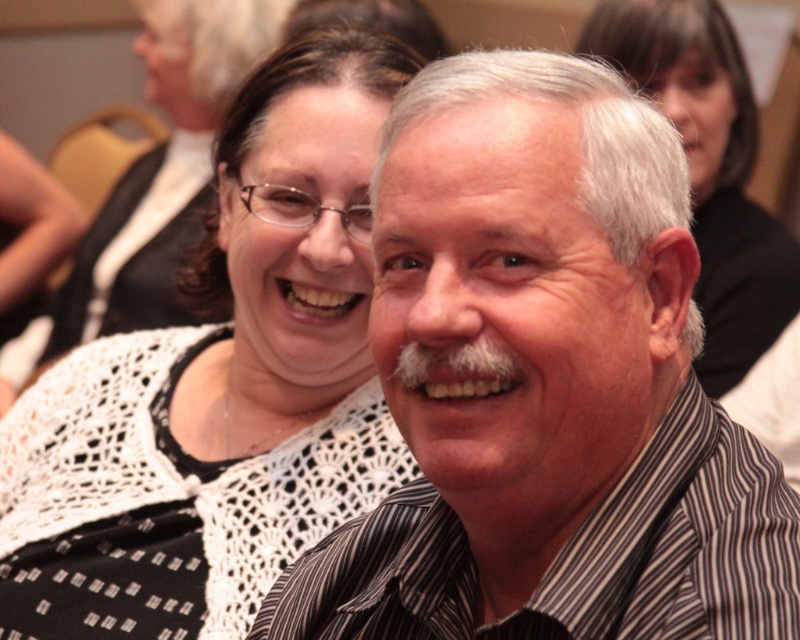
Question: Considering the real-world distances, which object is farthest from the striped shirt at center?

Choices:
 (A) white crochet sweater at upper center
 (B) striped cotton shirt at center

Answer: (A)

Question: Among these objects, which one is farthest from the camera?

Choices:
 (A) white lace top at upper center
 (B) striped shirt at center
 (C) striped cotton shirt at center

Answer: (A)

Question: Does striped shirt at center have a larger size compared to white lace top at upper center?

Choices:
 (A) yes
 (B) no

Answer: (B)

Question: Which object is farther from the camera taking this photo?

Choices:
 (A) striped cotton shirt at center
 (B) white crochet sweater at upper center
 (C) striped shirt at center

Answer: (B)

Question: Is white crochet sweater at upper center to the right of white lace top at upper center from the viewer's perspective?

Choices:
 (A) yes
 (B) no

Answer: (B)

Question: Is white crochet sweater at upper center positioned in front of striped cotton shirt at center?

Choices:
 (A) no
 (B) yes

Answer: (A)